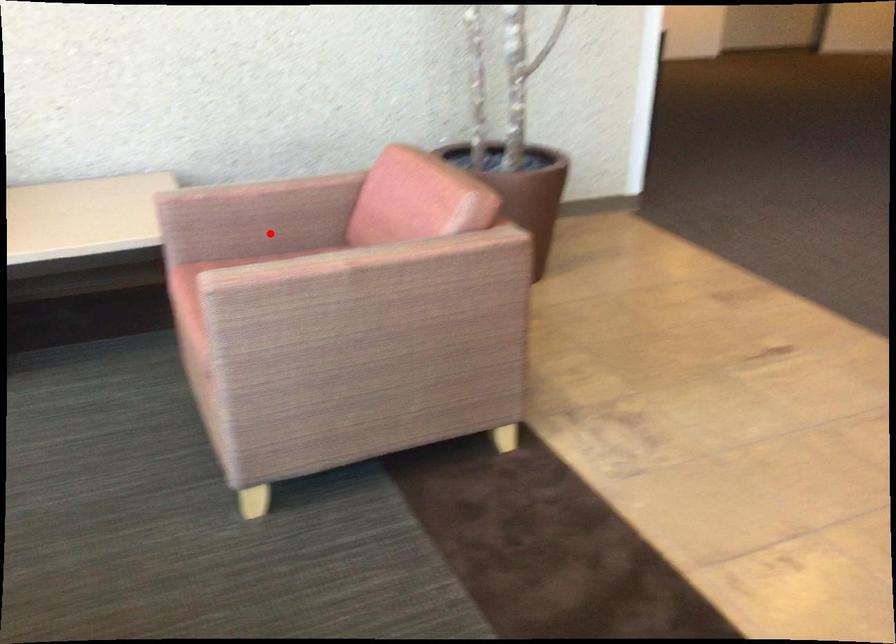
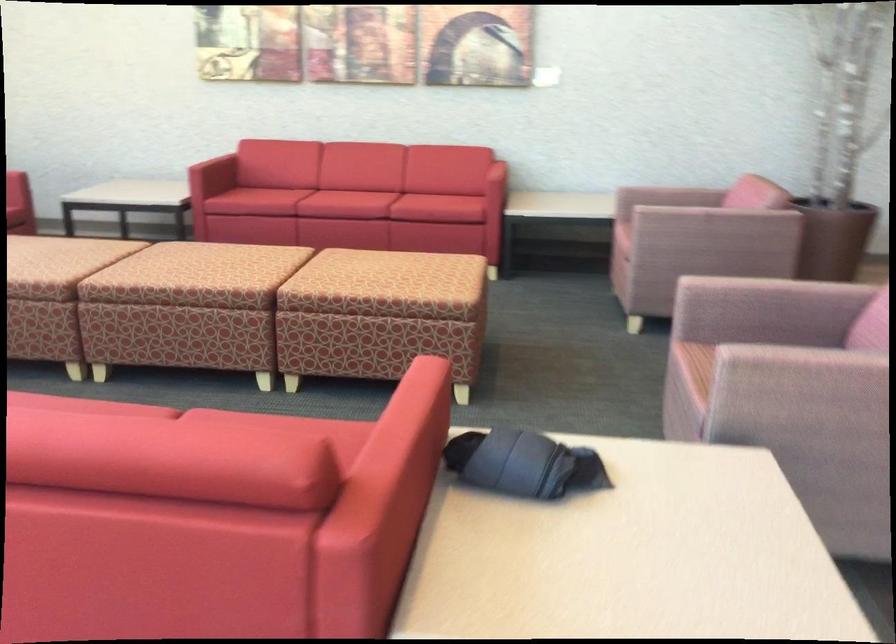
Question: A red point is marked in image1. In image2, is the corresponding 3D point closer to the camera or farther? Reply with the corresponding letter.

Choices:
 (A) The corresponding 3D point is closer.
 (B) The corresponding 3D point is farther.

Answer: (B)